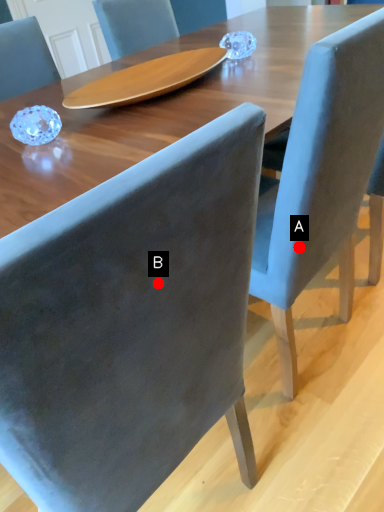
Question: Two points are circled on the image, labeled by A and B beside each circle. Which point is closer to the camera taking this photo?

Choices:
 (A) A is closer
 (B) B is closer

Answer: (B)